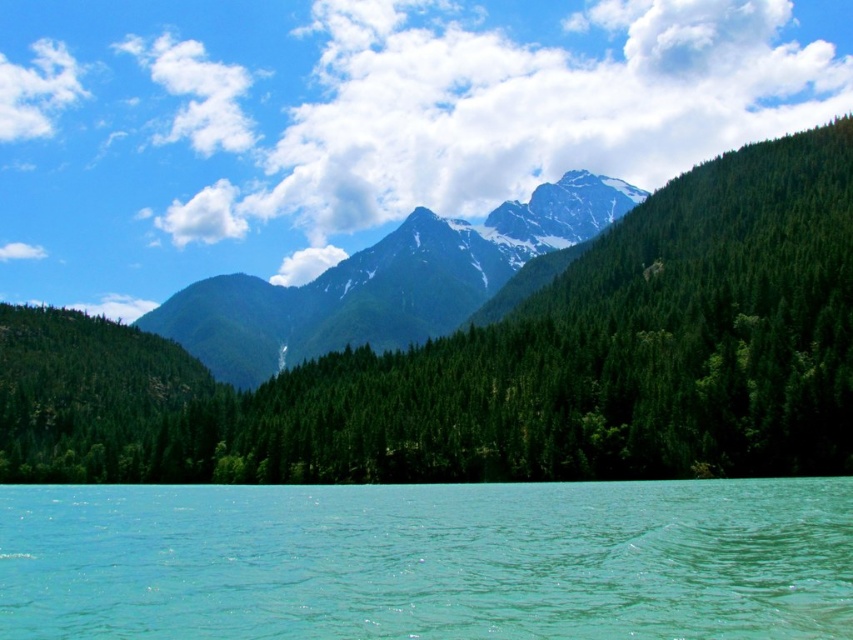
You are standing at the edge of the turquoise water in the foreground of the image. You want to walk directly towards the point labeled as point [509,364]. Based on the scene description, what will you encounter first as you walk in that direction?

You will first encounter the green matte forest at center before reaching the point [509,364] because the forest is located in the midground between the foreground water and the background mountains.

You are standing at the edge of the lake and see two points in the image. One is labeled as point [556,508] and the other as point [335,305]. Which point is nearer to your current position?

Point [556,508] is closer to the camera than point [335,305], so it is nearer to your current position.